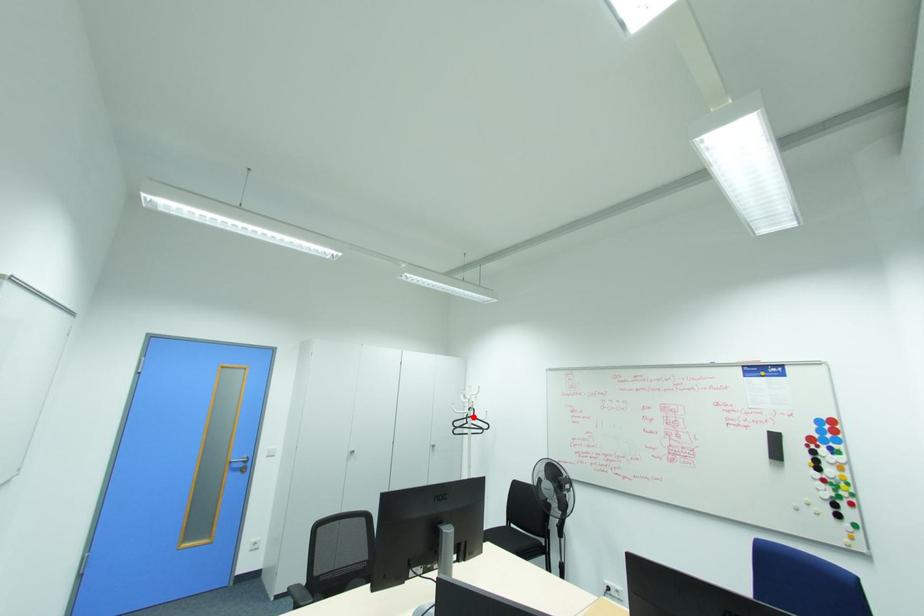
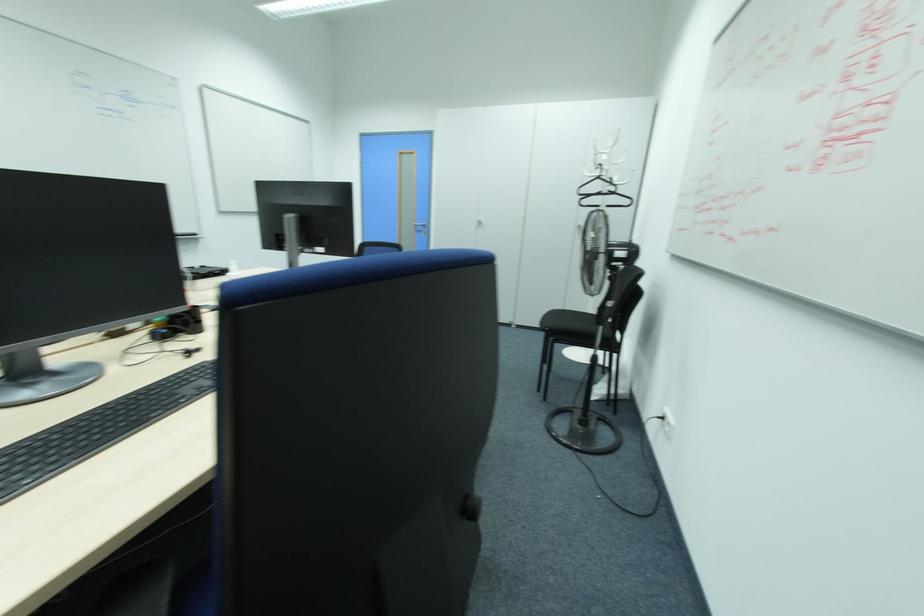
Question: I am providing you with two images of the same scene from different viewpoints. A red point is shown in image1. For the corresponding object point in image2, is it positioned nearer or farther from the camera?

Choices:
 (A) Nearer
 (B) Farther

Answer: (A)